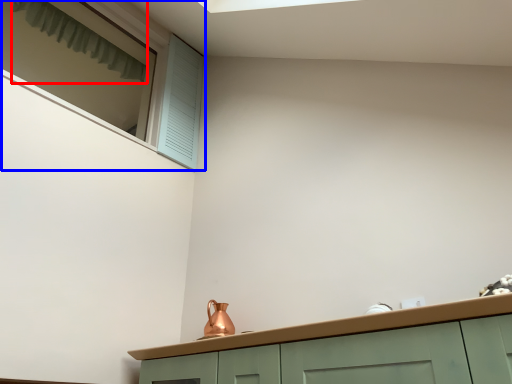
Question: Which object appears closest to the camera in this image, curtain (highlighted by a red box) or window (highlighted by a blue box)?

Choices:
 (A) curtain
 (B) window

Answer: (B)